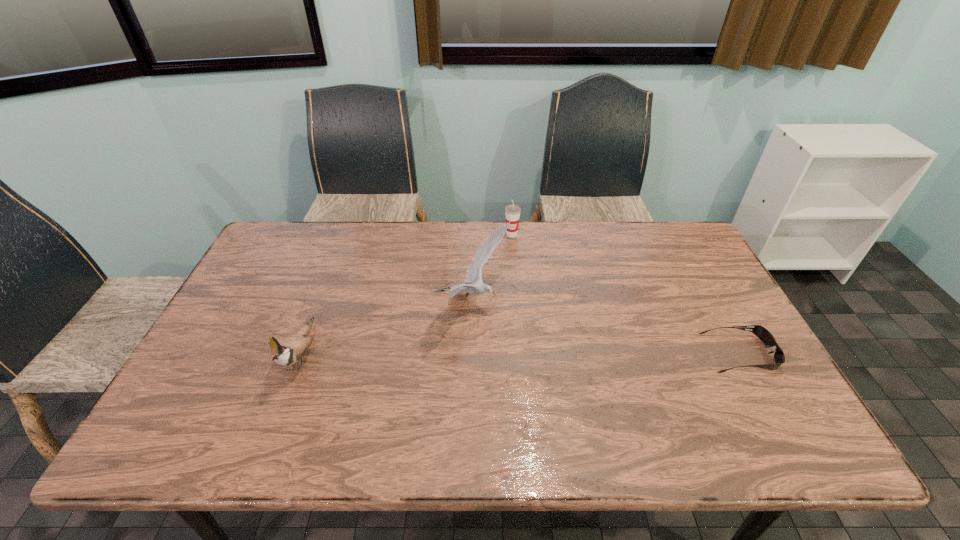
You are a GUI agent. You are given a task and a screenshot of the screen. Output one action in this format:
    pyautogui.click(x=<x>, y=<y>)
    Task: Click on the bird
    The height and width of the screenshot is (540, 960).
    Given the screenshot: What is the action you would take?
    pyautogui.click(x=288, y=350)

This screenshot has height=540, width=960. What are the coordinates of `the shortest object` in the screenshot? It's located at (763, 334).

Where is `sunglasses`? This screenshot has width=960, height=540. sunglasses is located at coordinates (763, 334).

Identify the location of the second shortest object. (512, 212).

At what (x,y) coordinates should I click in order to perform the action: click on the farthest object. Please return your answer as a coordinate pair (x, y). Looking at the image, I should click on 512,212.

Where is `gull`? Image resolution: width=960 pixels, height=540 pixels. gull is located at coordinates (474, 272).

The height and width of the screenshot is (540, 960). I want to click on vacant space located on the side of the cup with the logo, so click(x=525, y=293).

Locate an element on the screen. The height and width of the screenshot is (540, 960). free region located 0.220m on the side of the cup with the logo is located at coordinates (522, 282).

The height and width of the screenshot is (540, 960). In order to click on free region located on the side of the cup with the logo in this screenshot , I will do `click(529, 308)`.

The height and width of the screenshot is (540, 960). What are the coordinates of `vacant area situated at the tip of the beak of the gull` in the screenshot? It's located at (645, 391).